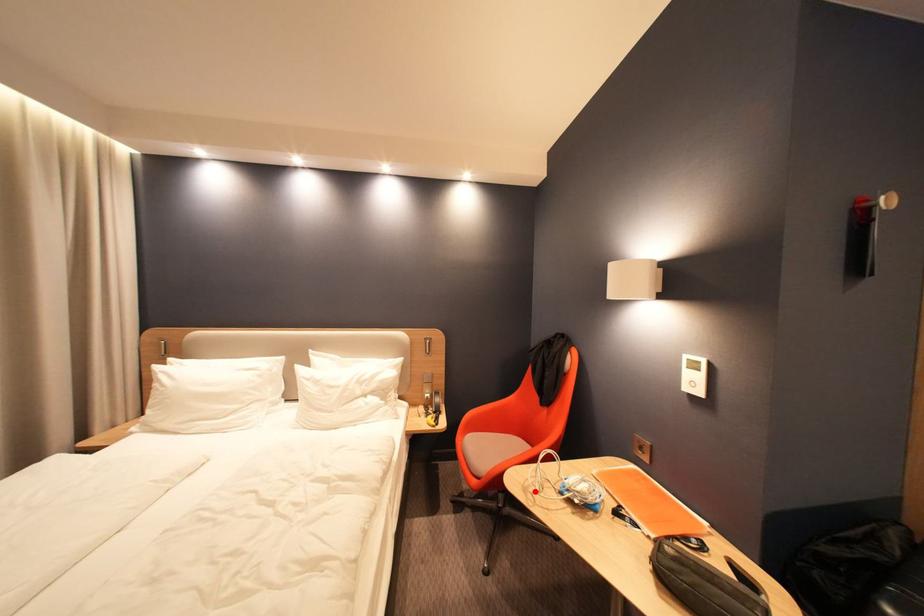
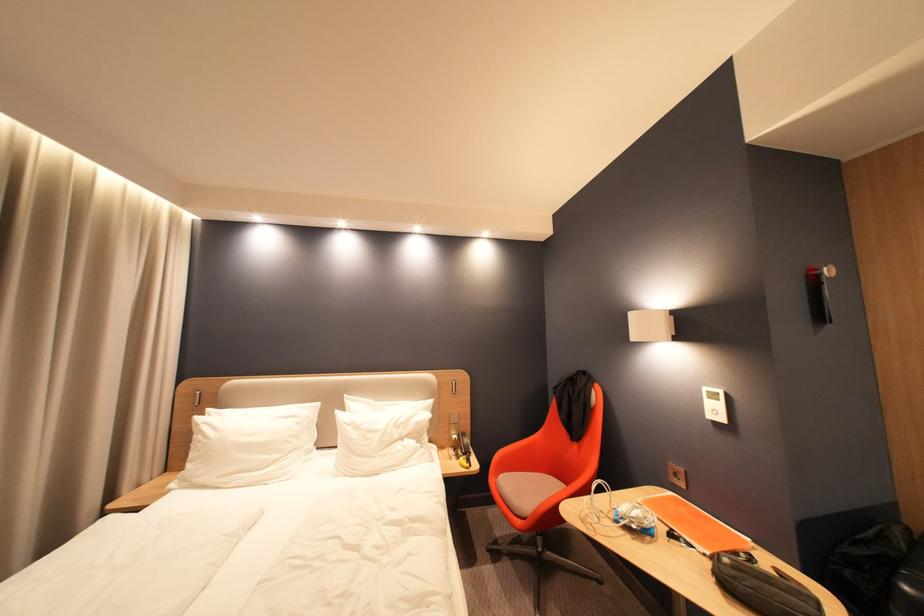
Find the pixel in the second image that matches the highlighted location in the first image.

(592, 523)